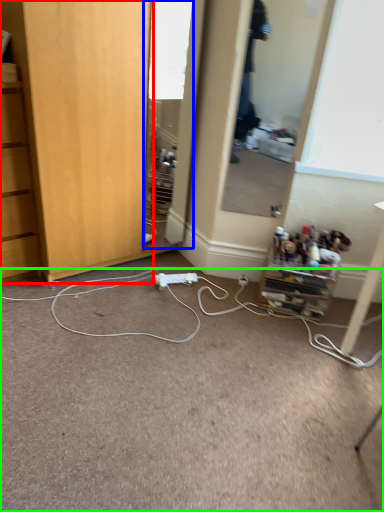
Question: Considering the real-world distances, which object is farthest from cabinetry (highlighted by a red box)? mirror (highlighted by a blue box) or plain (highlighted by a green box)?

Choices:
 (A) mirror
 (B) plain

Answer: (A)